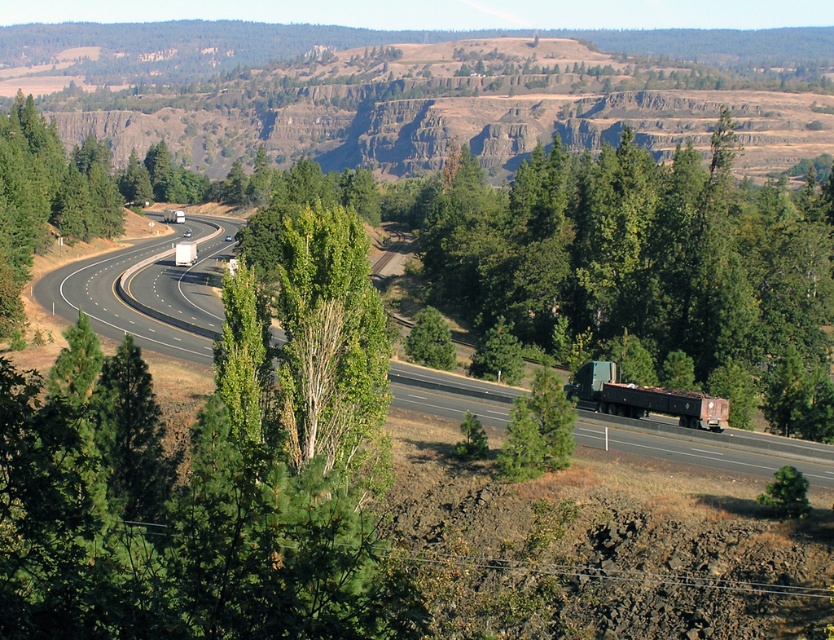
Question: Does rugged brown cliff at upper center come behind green leafy tree at center?

Choices:
 (A) no
 (B) yes

Answer: (B)

Question: Is green leafy tree at right below black asphalt highway at center?

Choices:
 (A) yes
 (B) no

Answer: (B)

Question: Which is farther from the rusty metal trailer truck at right?

Choices:
 (A) black asphalt highway at center
 (B) smooth asphalt highway at center-left
 (C) rugged brown cliff at upper center
 (D) green leafy tree at right

Answer: (C)

Question: Can you confirm if green leafy tree at right is wider than black asphalt highway at center?

Choices:
 (A) no
 (B) yes

Answer: (B)

Question: Which point is farther to the camera?

Choices:
 (A) smooth asphalt highway at center-left
 (B) rusty metal trailer truck at right

Answer: (A)

Question: Which point is farther from the camera taking this photo?

Choices:
 (A) (724, 154)
 (B) (69, 67)
 (C) (149, 323)

Answer: (B)